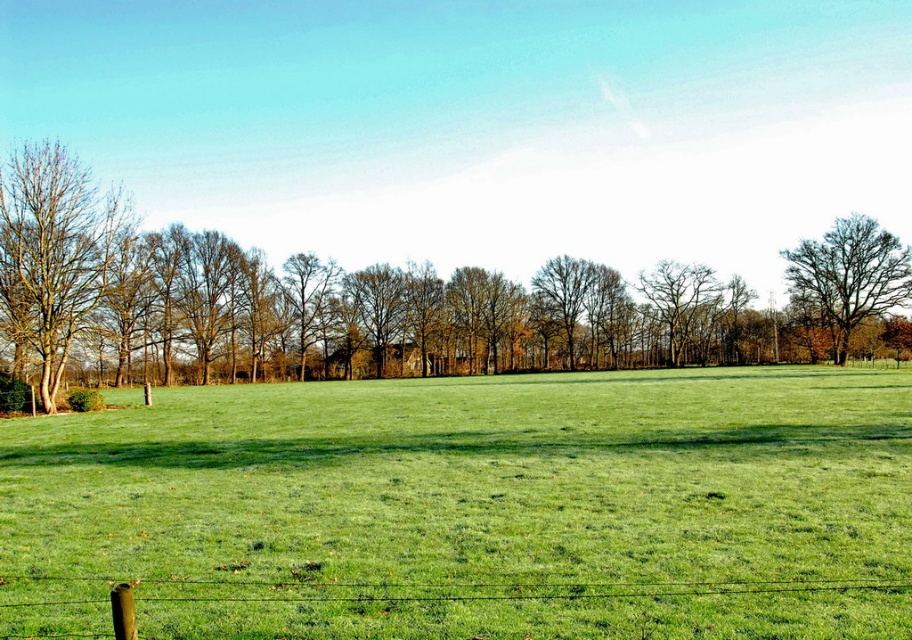
Can you confirm if brown leafless tree at left is positioned above brown textured tree at left?

No, brown leafless tree at left is not above brown textured tree at left.

Does brown leafless tree at left have a larger size compared to brown textured tree at left?

Indeed, brown leafless tree at left has a larger size compared to brown textured tree at left.

Between point (470, 310) and point (43, 227), which one is positioned in front?

Point (43, 227) is more forward.

Where is `brown leafless tree at left`? This screenshot has height=640, width=912. brown leafless tree at left is located at coordinates (389, 301).

Which is more to the left, green grassy field at center or brown leafless tree at left?

brown leafless tree at left

From the picture: Measure the distance from green grassy field at center to brown leafless tree at left.

green grassy field at center is 95.53 feet from brown leafless tree at left.

Measure the distance between green grassy field at center and camera.

green grassy field at center and camera are 6.65 meters apart.

The width and height of the screenshot is (912, 640). Identify the location of green grassy field at center. (470, 508).

Is brown textured tree at left below bare brown tree at right?

No.

Is brown textured tree at left shorter than bare brown tree at right?

No.

Image resolution: width=912 pixels, height=640 pixels. I want to click on brown textured tree at left, so click(50, 253).